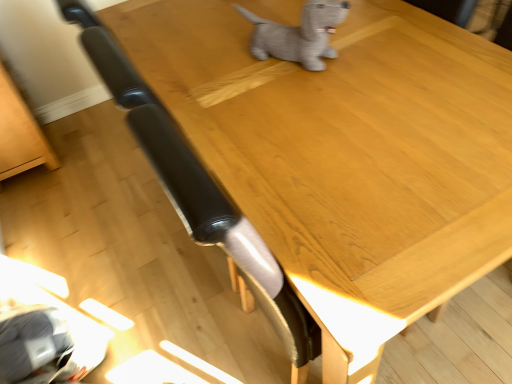
Question: Does light brown wood table at lower left have a greater height compared to gray plush dog at upper center?

Choices:
 (A) yes
 (B) no

Answer: (A)

Question: From a real-world perspective, is light brown wood table at lower left positioned over gray plush dog at upper center based on gravity?

Choices:
 (A) yes
 (B) no

Answer: (B)

Question: Considering the relative sizes of light brown wood table at lower left and gray plush dog at upper center in the image provided, is light brown wood table at lower left thinner than gray plush dog at upper center?

Choices:
 (A) no
 (B) yes

Answer: (A)

Question: Is light brown wood table at lower left aimed at gray plush dog at upper center?

Choices:
 (A) no
 (B) yes

Answer: (A)

Question: From a real-world perspective, is light brown wood table at lower left positioned under gray plush dog at upper center based on gravity?

Choices:
 (A) no
 (B) yes

Answer: (B)

Question: Can you confirm if light brown wood table at lower left is positioned to the right of gray plush dog at upper center?

Choices:
 (A) yes
 (B) no

Answer: (B)

Question: From the image's perspective, is gray plush dog at upper center over light brown wood table at lower left?

Choices:
 (A) yes
 (B) no

Answer: (A)

Question: Does gray plush dog at upper center have a lesser height compared to light brown wood table at lower left?

Choices:
 (A) no
 (B) yes

Answer: (B)

Question: From a real-world perspective, is gray plush dog at upper center located higher than light brown wood table at lower left?

Choices:
 (A) yes
 (B) no

Answer: (A)

Question: From a real-world perspective, does gray plush dog at upper center sit lower than light brown wood table at lower left?

Choices:
 (A) no
 (B) yes

Answer: (A)

Question: From the image's perspective, is gray plush dog at upper center beneath light brown wood table at lower left?

Choices:
 (A) no
 (B) yes

Answer: (A)

Question: Is gray plush dog at upper center outside light brown wood table at lower left?

Choices:
 (A) no
 (B) yes

Answer: (B)

Question: In terms of width, does light brown wood table at lower left look wider or thinner when compared to gray plush dog at upper center?

Choices:
 (A) wide
 (B) thin

Answer: (A)